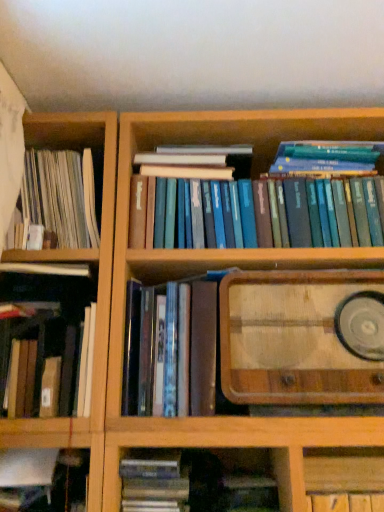
Question: From the image's perspective, is matte plastic books at center, positioned as the fifth book in left-to-right order, positioned above or below hardcover book at center, positioned as the third book in right-to-left order?

Choices:
 (A) above
 (B) below

Answer: (A)

Question: Is point (137, 384) positioned closer to the camera than point (168, 489)?

Choices:
 (A) farther
 (B) closer

Answer: (A)

Question: Which of these objects is positioned closest to the hardcover book at center, positioned as the third book in right-to-left order?

Choices:
 (A) white paperbacks at left, which is counted as the sixth book, starting from the right
 (B) matte plastic books at center, positioned as the fifth book in left-to-right order
 (C) wooden radio at center-right
 (D) hardcover book at left, the third book when ordered from left to right
 (E) wooden cabinet at lower right

Answer: (B)

Question: Which is farther from the hardcover book at left, which is counted as the 4th book, starting from the right?

Choices:
 (A) hardcover book at lower left, the fifth book positioned from the right
 (B) white paperbacks at left, which is counted as the sixth book, starting from the right
 (C) wooden radio at center-right
 (D) blue hardcover books at upper center, which is the first book from right to left
 (E) wooden cabinet at lower right

Answer: (E)